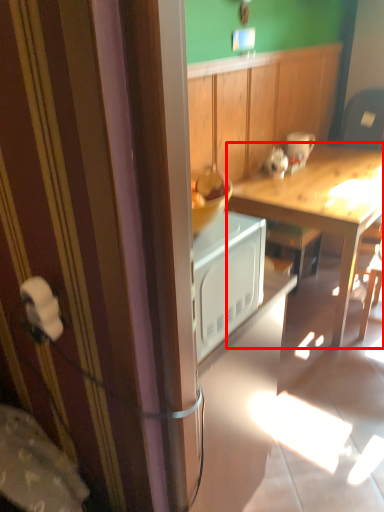
Question: From the image's perspective, considering the relative positions of desk (annotated by the red box) and coffee cup in the image provided, where is desk (annotated by the red box) located with respect to the staircase?

Choices:
 (A) above
 (B) below

Answer: (B)